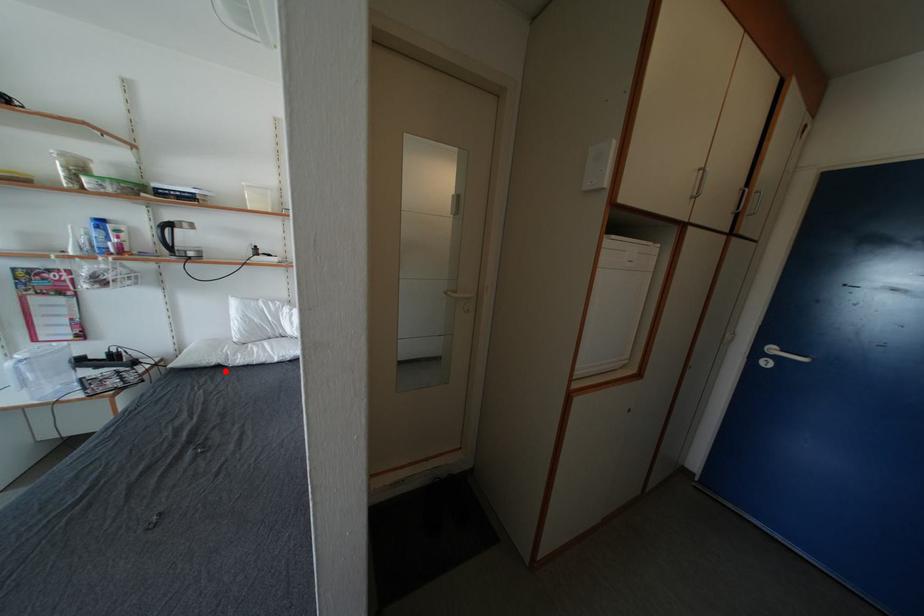
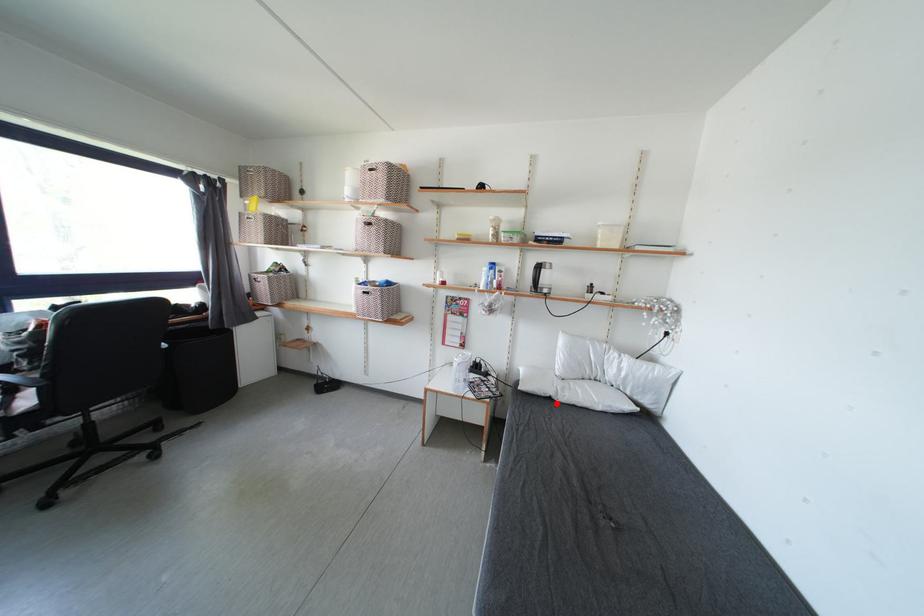
I am providing you with two images of the same scene from different viewpoints. A red point is marked on the first image and another point is marked on the second image. Do the highlighted points in image1 and image2 indicate the same real-world spot?

Yes